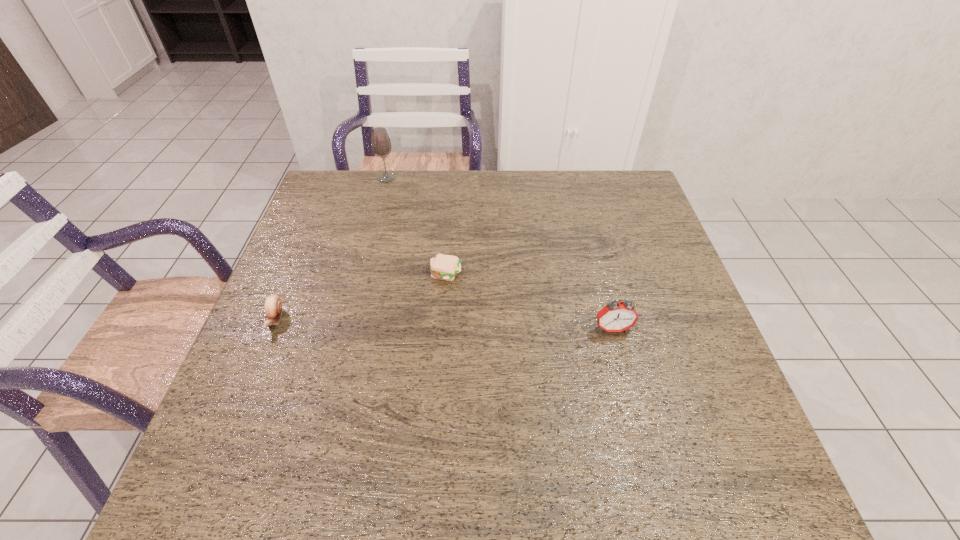
Locate an element on the screen. vacant region located on the front-facing side of the leftmost object is located at coordinates (253, 373).

At what (x,y) coordinates should I click in order to perform the action: click on free space located 0.210m on the back of the shortest object. Please return your answer as a coordinate pair (x, y). The width and height of the screenshot is (960, 540). Looking at the image, I should click on (450, 214).

The height and width of the screenshot is (540, 960). I want to click on object that is at the far edge, so click(x=381, y=145).

You are a GUI agent. You are given a task and a screenshot of the screen. Output one action in this format:
    pyautogui.click(x=<x>, y=<y>)
    Task: Click on the object present at the left edge
    This screenshot has width=960, height=540.
    Given the screenshot: What is the action you would take?
    pyautogui.click(x=273, y=306)

In the image, there is a desktop. At what (x,y) coordinates should I click in order to perform the action: click on vacant space at the far edge. Please return your answer as a coordinate pair (x, y). The image size is (960, 540). Looking at the image, I should click on (590, 213).

You are a GUI agent. You are given a task and a screenshot of the screen. Output one action in this format:
    pyautogui.click(x=<x>, y=<y>)
    Task: Click on the vacant area at the near edge of the desktop
    Image resolution: width=960 pixels, height=540 pixels.
    Given the screenshot: What is the action you would take?
    pyautogui.click(x=633, y=468)

Locate an element on the screen. The height and width of the screenshot is (540, 960). vacant space at the left edge is located at coordinates (259, 445).

Locate an element on the screen. The image size is (960, 540). free space at the right edge of the desktop is located at coordinates (630, 278).

In the image, there is a desktop. Where is `vacant space at the far left corner`? The width and height of the screenshot is (960, 540). vacant space at the far left corner is located at coordinates (340, 172).

In the image, there is a desktop. Where is `vacant area at the far right corner`? This screenshot has height=540, width=960. vacant area at the far right corner is located at coordinates (623, 173).